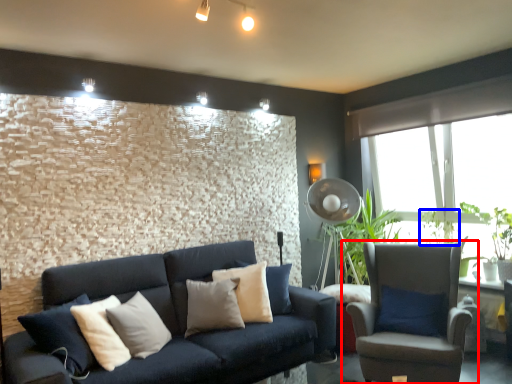
Question: Which point is closer to the camera, chair (highlighted by a red box) or plant (highlighted by a blue box)?

Choices:
 (A) chair
 (B) plant

Answer: (A)